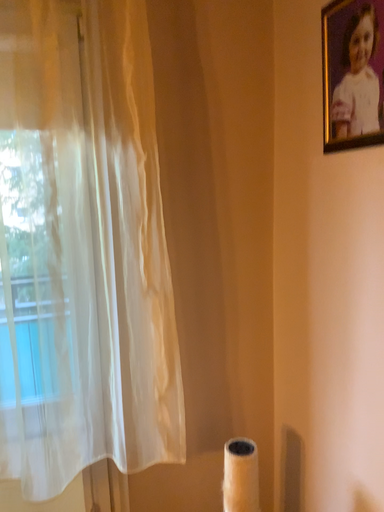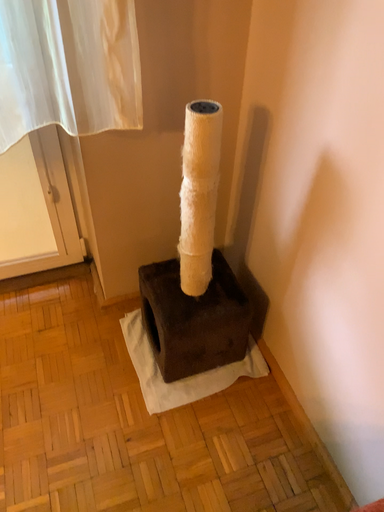
Question: Which way did the camera rotate in the video?

Choices:
 (A) rotated downward
 (B) rotated upward

Answer: (A)